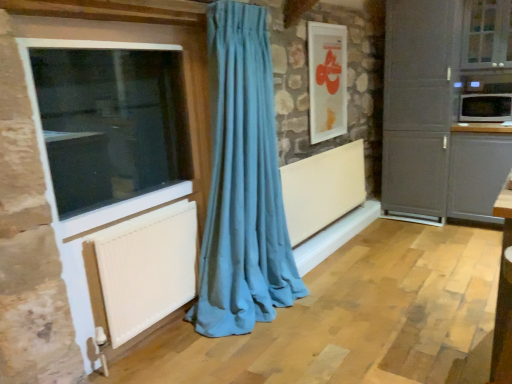
Question: Would you say teal fabric curtain at center is inside or outside clear glass window at upper right, acting as the 1th window starting from the top?

Choices:
 (A) inside
 (B) outside

Answer: (B)

Question: From a real-world perspective, is teal fabric curtain at center above or below clear glass window at upper right, the 2th window from the front?

Choices:
 (A) below
 (B) above

Answer: (A)

Question: Based on their relative distances, which object is nearer to the matte gray cabinet at right, acting as the 1th cabinetry starting from the left?

Choices:
 (A) teal fabric curtain at center
 (B) matte gray cabinet at right, which appears as the 1th cabinetry when viewed from the right
 (C) white glossy picture frame at upper center
 (D) white glossy microwave at upper right
 (E) clear glass window at upper right, which appears as the 1th window when viewed from the back

Answer: (B)

Question: Considering the real-world distances, which object is closest to the matte gray cabinet at right, which appears as the 1th cabinetry when viewed from the right?

Choices:
 (A) white glossy microwave at upper right
 (B) white matte radiator at center, marked as the second radiator in a front-to-back arrangement
 (C) matte gray cabinet at right, acting as the 1th cabinetry starting from the left
 (D) white glossy picture frame at upper center
 (E) teal fabric curtain at center

Answer: (C)